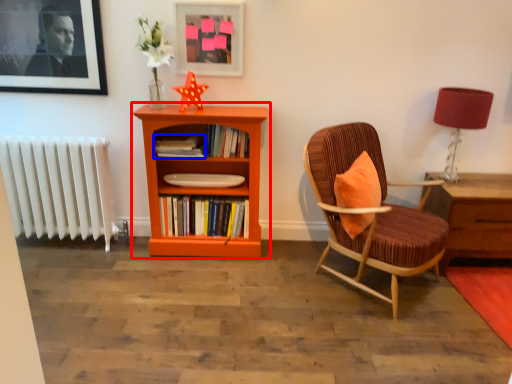
Question: Which object appears farthest to the camera in this image, bookcase (highlighted by a red box) or book (highlighted by a blue box)?

Choices:
 (A) bookcase
 (B) book

Answer: (B)